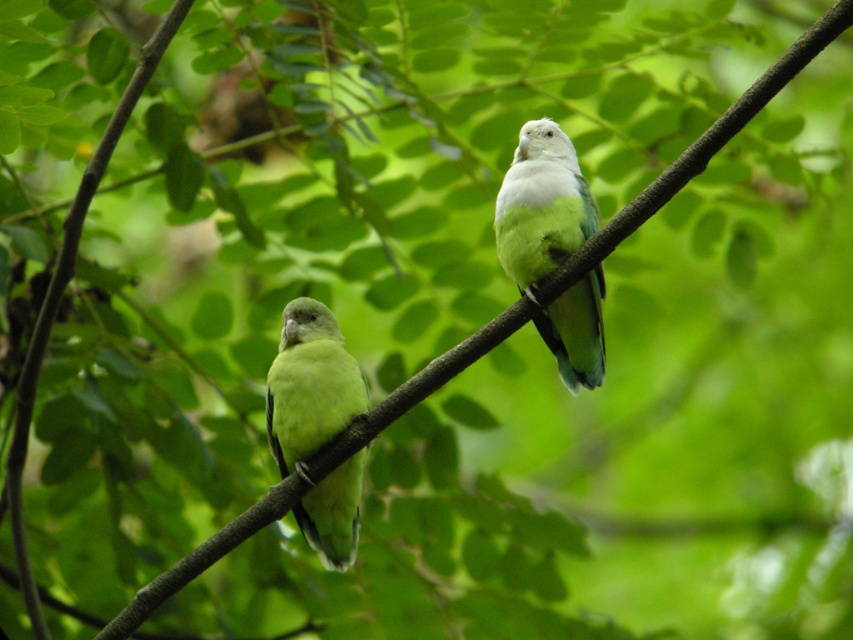
Where is the green matte parrot at center located in the image?

The green matte parrot at center is located at point (541, 205) in the image.

You are an ornithologist observing two green matte parrots in the image. Which parrot, the green matte parrot at center or the green matte parrot at left, is bigger in size?

The green matte parrot at center is larger in size than the green matte parrot at left.

In the scene shown: You are an ornithologist observing two green matte parrots in the scene. Which of the two green matte parrot at center and green matte parrot at left is taller?

The green matte parrot at center has a greater height compared to the green matte parrot at left.